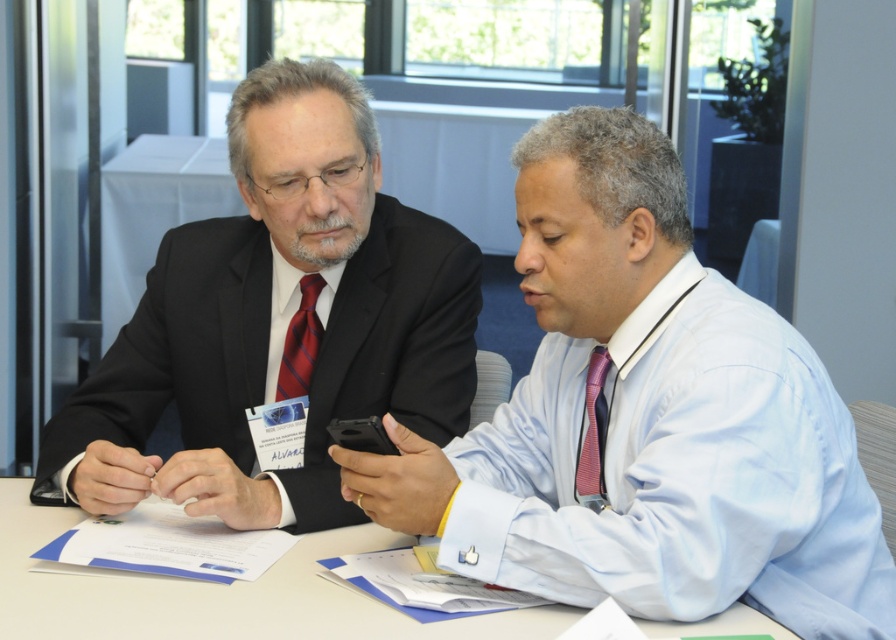
Question: Among these points, which one is farthest from the camera?

Choices:
 (A) (112, 468)
 (B) (588, 392)
 (C) (295, 339)
 (D) (240, 592)

Answer: (C)

Question: Which point appears closest to the camera in this image?

Choices:
 (A) (717, 608)
 (B) (309, 624)
 (C) (601, 433)

Answer: (A)

Question: Is white paper at center positioned in front of purple striped tie at right?

Choices:
 (A) no
 (B) yes

Answer: (B)

Question: Does white paper at center have a greater width compared to matte red tie at center?

Choices:
 (A) no
 (B) yes

Answer: (B)

Question: Which point is closer to the camera?

Choices:
 (A) pyautogui.click(x=745, y=627)
 (B) pyautogui.click(x=242, y=298)
 (C) pyautogui.click(x=890, y=586)
 (D) pyautogui.click(x=576, y=499)

Answer: (A)

Question: Is light blue shirt at center positioned at the back of purple striped tie at right?

Choices:
 (A) yes
 (B) no

Answer: (B)